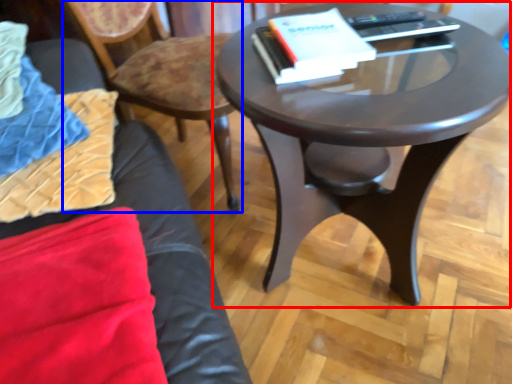
Question: Which object is further to the camera taking this photo, coffee table (highlighted by a red box) or chair (highlighted by a blue box)?

Choices:
 (A) coffee table
 (B) chair

Answer: (B)